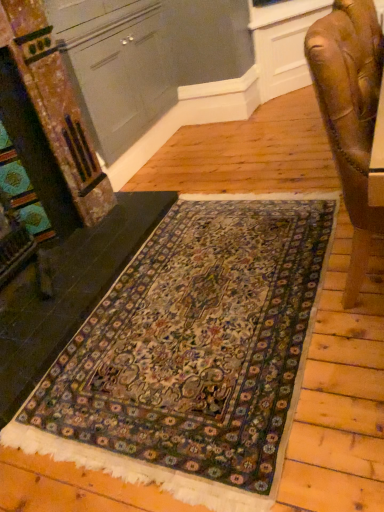
Locate an element on the screen. The height and width of the screenshot is (512, 384). free spot above carpet at lower left (from a real-world perspective) is located at coordinates (64, 269).